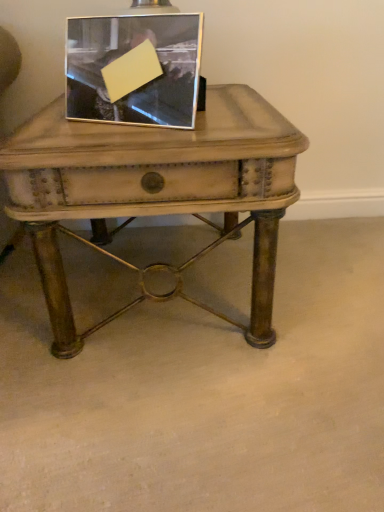
At what (x,y) coordinates should I click in order to perform the action: click on vacant region in front of metallic silver picture frame at upper center. Please return your answer as a coordinate pair (x, y). Looking at the image, I should click on (128, 143).